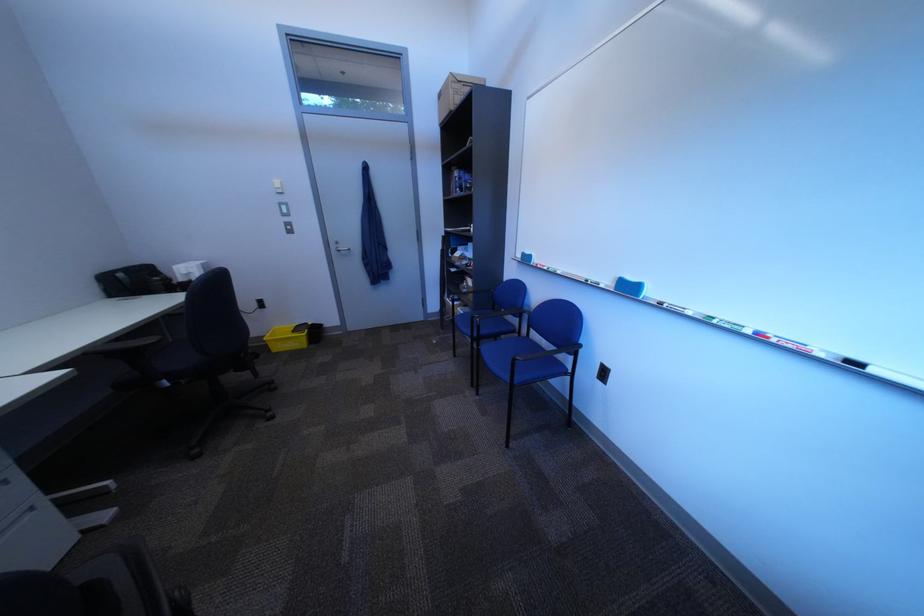
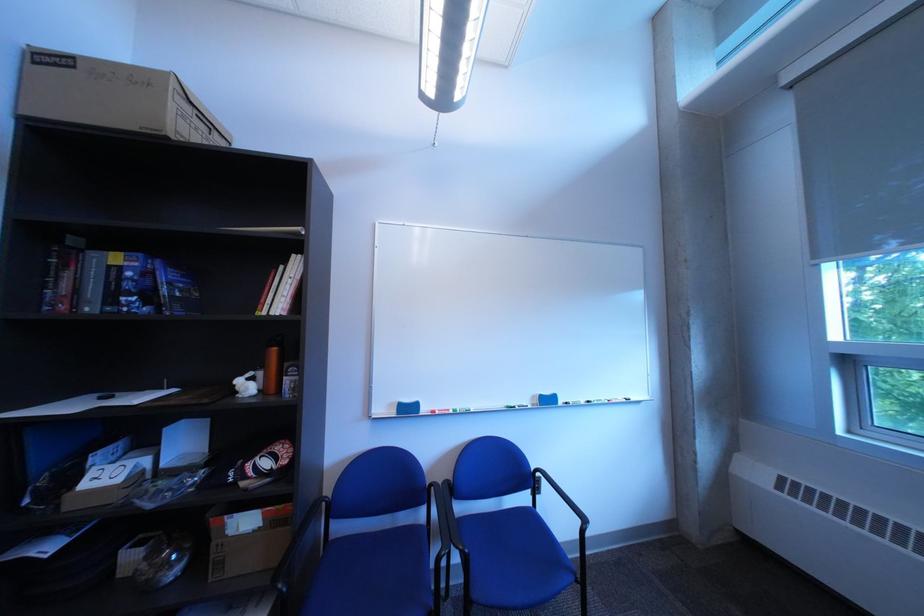
Find the pixel in the second image that matches the point at 473,191 in the first image.

(150, 300)